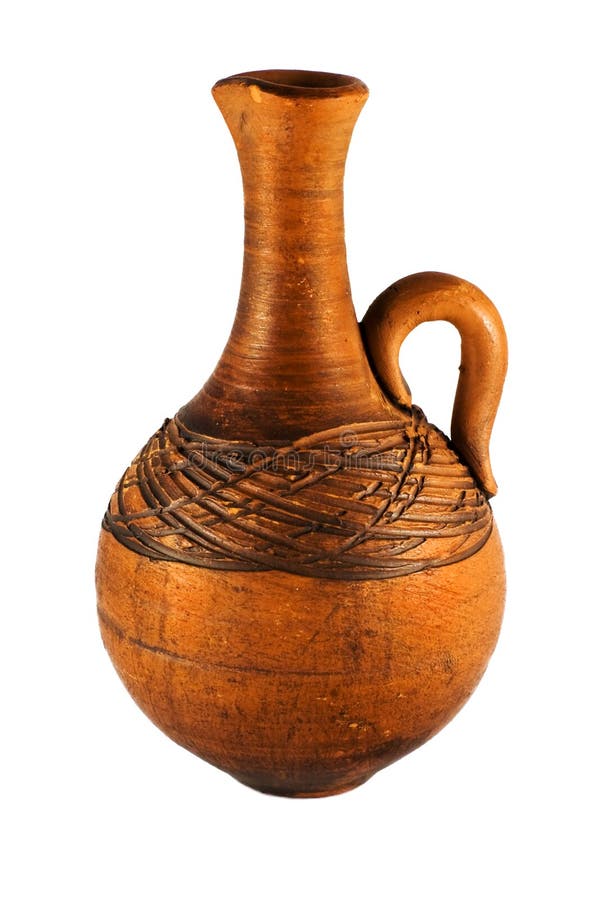
Find the location of a particular element. This screenshot has width=602, height=900. chips/marks on carafe is located at coordinates click(x=352, y=726), click(x=385, y=733), click(x=400, y=695), click(x=320, y=697).